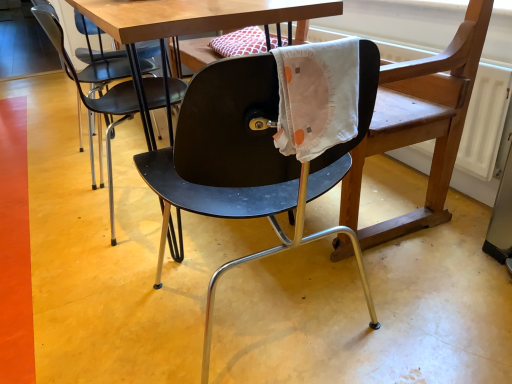
I want to click on vacant area in front of matte black chair at center, which appears as the 1th chair when viewed from the left, so click(96, 256).